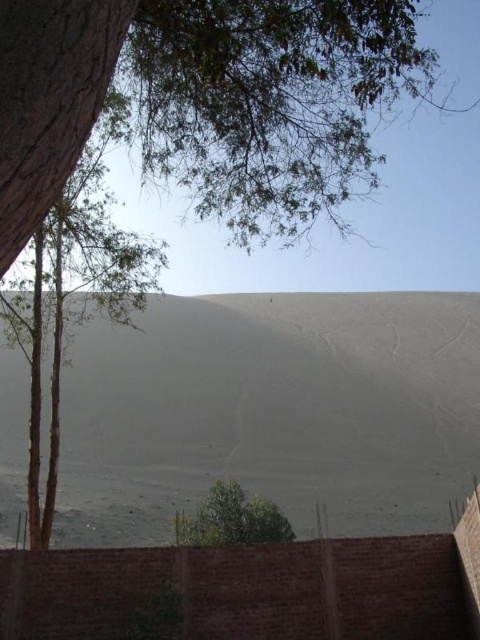
Who is more distant from viewer, (249, 339) or (28, 426)?

Positioned behind is point (249, 339).

Which is above, gray sand dune at center or green leafy tree at left?

Positioned higher is green leafy tree at left.

Locate an element on the screen. gray sand dune at center is located at coordinates (272, 412).

Between point (168, 506) and point (214, 502), which one is positioned behind?

The point (168, 506) is behind.

Who is shorter, gray sand dune at center or green leafy tree at lower center?

Standing shorter between the two is green leafy tree at lower center.

What do you see at coordinates (272, 412) in the screenshot? I see `gray sand dune at center` at bounding box center [272, 412].

At what (x,y) coordinates should I click in order to perform the action: click on gray sand dune at center. Please return your answer as a coordinate pair (x, y). Looking at the image, I should click on (272, 412).

Is point (26, 348) behind point (229, 513)?

Yes, it is behind point (229, 513).

The height and width of the screenshot is (640, 480). I want to click on green leafy tree at left, so click(x=74, y=288).

Who is more forward, (x=0, y=305) or (x=214, y=538)?

Positioned in front is point (x=0, y=305).

Locate an element on the screen. This screenshot has width=480, height=640. green leafy tree at left is located at coordinates (74, 288).